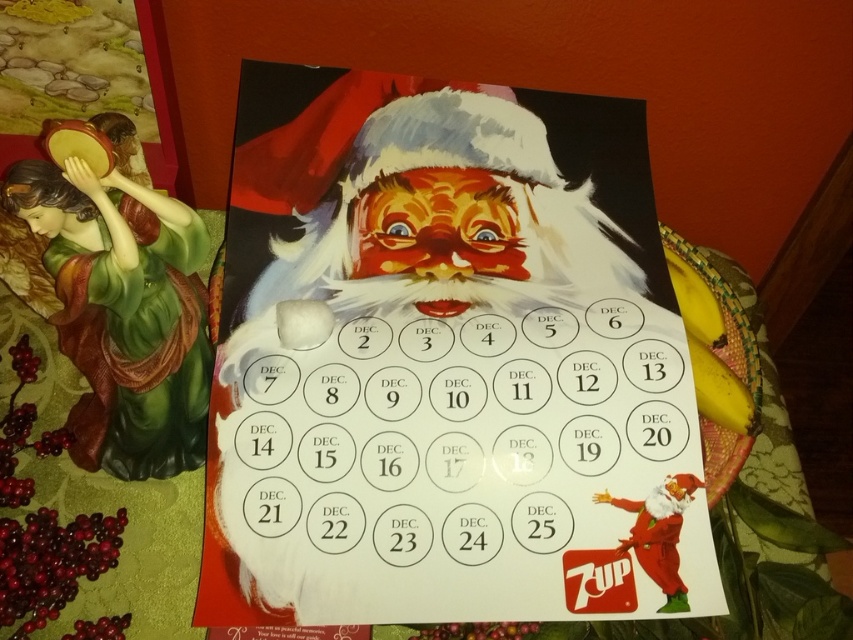
You are an interior designer planning to hang a new picture on the wall. You notice the matte paper calendar at center and the shiny red santa at center. Which object is positioned closer to the wall?

The shiny red santa at center is further away from the wall than the matte paper calendar at center, so the matte paper calendar at center is closer to the wall.

From the picture: You are a painter standing in front of the festive calendar scene. You want to paint the matte paper calendar at center and the red velvet santa at lower right. Which object should you paint first if you want to start with the one closer to you?

The matte paper calendar at center is closer to the viewer than the red velvet santa at lower right, so you should paint the matte paper calendar at center first.